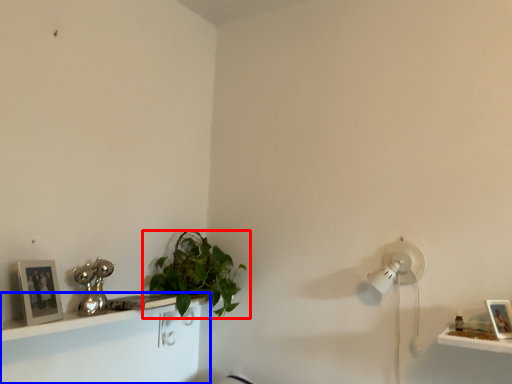
Question: Which object is closer to the camera taking this photo, houseplant (highlighted by a red box) or shelf (highlighted by a blue box)?

Choices:
 (A) houseplant
 (B) shelf

Answer: (B)